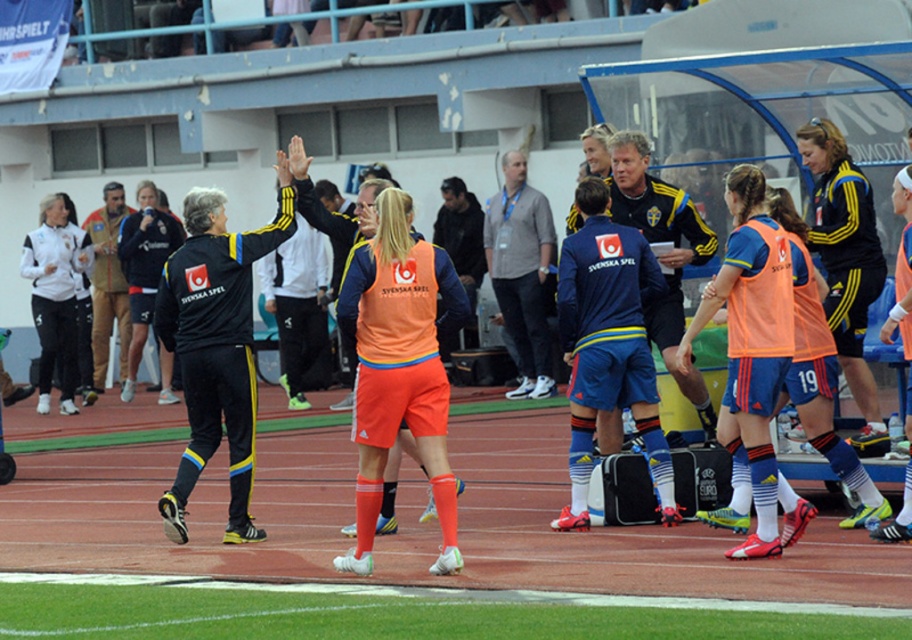
You are a photographer standing at the edge of the soccer field. You need to capture a photo that includes both the green turf at lower center and the brown leather jacket at left. Based on their positions, which object should appear lower in the photo?

The green turf at lower center should appear lower in the photo because it is located below the brown leather jacket at left.

You are a photographer positioned at the far left of the soccer field. You want to take a photo that includes both the matte blue shorts at center and the brown leather jacket at left. Which object should you adjust your camera to focus on first to ensure both are in frame?

The brown leather jacket at left should be focused on first since it is positioned to the left of the matte blue shorts at center, so adjusting focus starting from the left ensures both objects remain in frame.